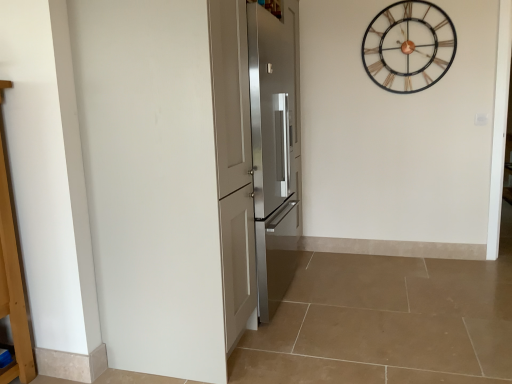
Question: Considering the positions of satin silver refrigerator at center, the second door in the back-to-front sequence, and metallic wireframe clock at upper right in the image, is satin silver refrigerator at center, the second door in the back-to-front sequence, wider or thinner than metallic wireframe clock at upper right?

Choices:
 (A) thin
 (B) wide

Answer: (B)

Question: In terms of height, does satin silver refrigerator at center, the 1th door positioned from the front, look taller or shorter compared to metallic wireframe clock at upper right?

Choices:
 (A) tall
 (B) short

Answer: (A)

Question: Which is farther from the metallic wireframe clock at upper right?

Choices:
 (A) satin silver refrigerator at center, the second door in the back-to-front sequence
 (B) stainless steel refrigerator at center, the first door in the back-to-front sequence

Answer: (A)

Question: Estimate the real-world distances between objects in this image. Which object is closer to the stainless steel refrigerator at center, marked as the 2th door in a front-to-back arrangement?

Choices:
 (A) satin silver refrigerator at center, the 1th door positioned from the front
 (B) metallic wireframe clock at upper right

Answer: (A)